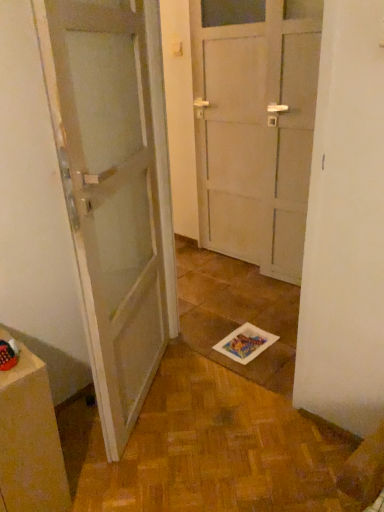
Identify the location of free spot below white glossy door at left (from a real-world perspective). This screenshot has width=384, height=512. coord(149,399).